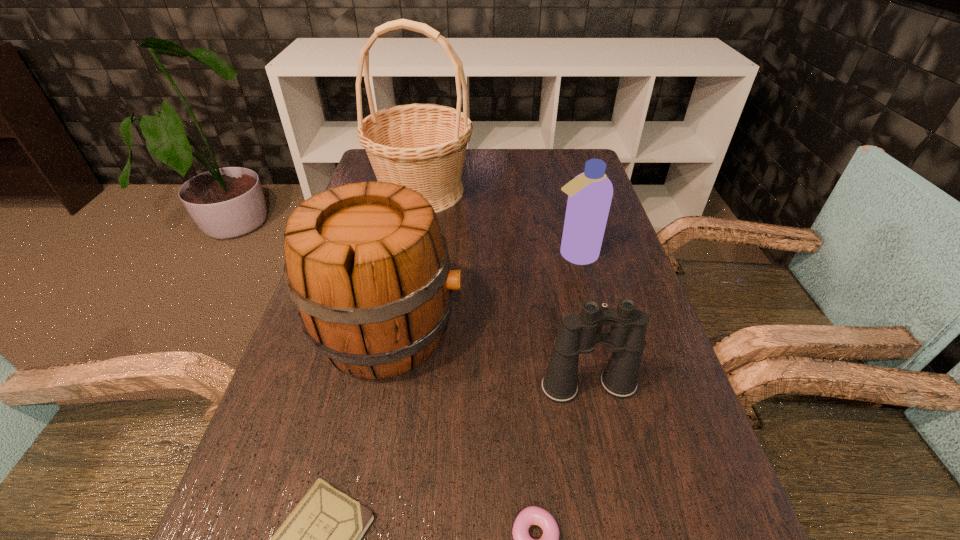
The width and height of the screenshot is (960, 540). Identify the location of the tallest object. (421, 146).

At what (x,y) coordinates should I click in order to perform the action: click on the farthest object. Please return your answer as a coordinate pair (x, y). This screenshot has height=540, width=960. Looking at the image, I should click on (421, 146).

Locate an element on the screen. Image resolution: width=960 pixels, height=540 pixels. cider is located at coordinates (367, 265).

At what (x,y) coordinates should I click in order to perform the action: click on shampoo. Please return your answer as a coordinate pair (x, y). Looking at the image, I should click on (590, 193).

This screenshot has width=960, height=540. I want to click on the fourth tallest object, so click(x=578, y=335).

Image resolution: width=960 pixels, height=540 pixels. In order to click on vacant area located 0.070m on the front of the farthest object in this screenshot , I will do click(x=414, y=236).

Identify the location of free space located on the side of the cider where the spigot is located. (527, 330).

At what (x,y) coordinates should I click in order to perform the action: click on free point located 0.370m on the left of the fifth nearest object. Please return your answer as a coordinate pair (x, y). The image size is (960, 540). Looking at the image, I should click on (407, 255).

The height and width of the screenshot is (540, 960). What are the coordinates of `blank area located 0.120m on the left of the third shortest object` in the screenshot? It's located at (478, 386).

Where is `object that is at the far edge`? Image resolution: width=960 pixels, height=540 pixels. object that is at the far edge is located at coordinates coord(421,146).